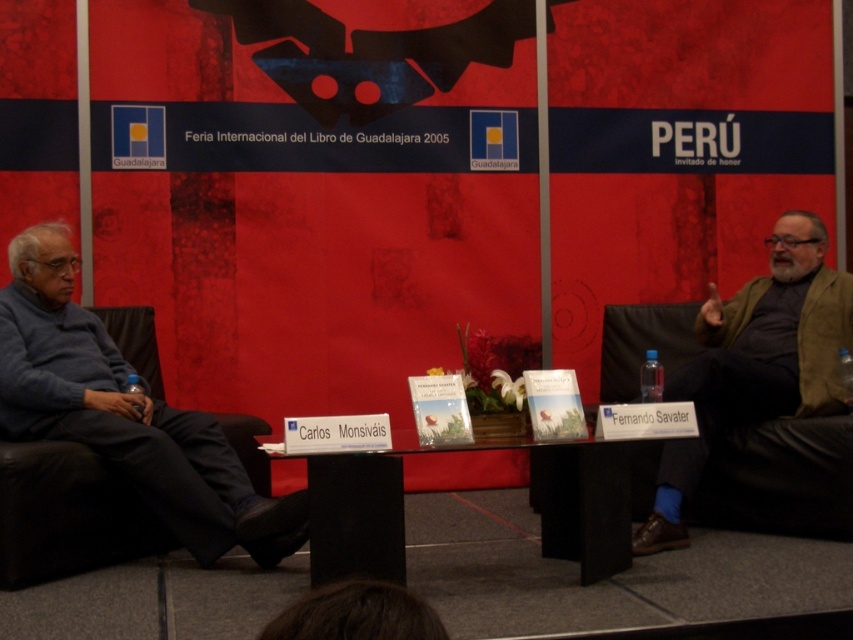
You are attending the Feria Internacional del Libro de Guadalajara 2005 and notice the blue sweater at left on the stage. If you want to take a photo of it from the audience seating area, which side of the stage should you position yourself to ensure the sweater is fully visible?

To fully see the blue sweater at left from the audience seating area, you should position yourself on the left side of the stage since the sweater is located at the left side according to its coordinates.